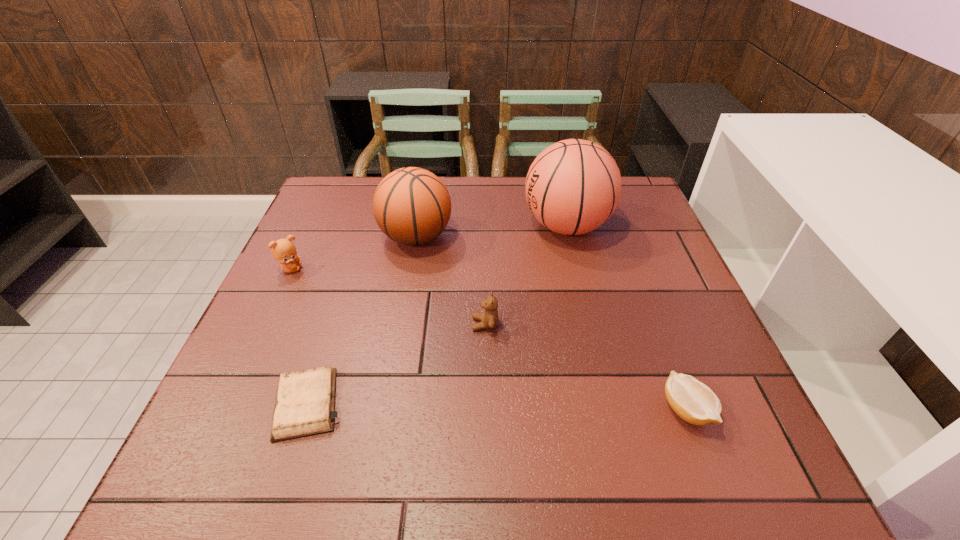
Where is `object located at the near edge`? This screenshot has height=540, width=960. object located at the near edge is located at coordinates pos(305,400).

Image resolution: width=960 pixels, height=540 pixels. In order to click on teddy bear situated at the left edge in this screenshot , I will do `click(283, 250)`.

Find the location of a particular element. This screenshot has width=960, height=540. diary that is positioned at the left edge is located at coordinates (305, 400).

Locate an element on the screen. basketball that is at the right edge is located at coordinates (572, 187).

At what (x,y) coordinates should I click in order to perform the action: click on lemon located at the right edge. Please return your answer as a coordinate pair (x, y). This screenshot has height=540, width=960. Looking at the image, I should click on (693, 401).

Identify the location of object positioned at the near left corner. (305, 400).

The height and width of the screenshot is (540, 960). In order to click on object that is positioned at the far right corner in this screenshot , I will do `click(572, 187)`.

Identify the location of vacant space at the far edge. (445, 178).

In the image, there is a desktop. Identify the location of free region at the left edge. The image size is (960, 540). (335, 248).

In the image, there is a desktop. At what (x,y) coordinates should I click in order to perform the action: click on vacant space at the right edge. Please return your answer as a coordinate pair (x, y). Looking at the image, I should click on (666, 355).